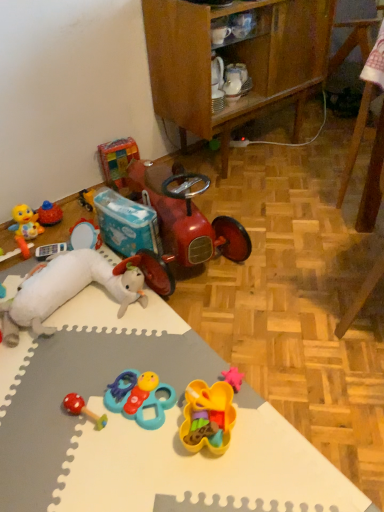
The width and height of the screenshot is (384, 512). What are the coordinates of `free space between translucent plastic toy at center, which is the 4th toy in top-to-bottom order, and teal plastic toy at center, which is counted as the 3th toy, starting from the front` in the screenshot? It's located at (182, 409).